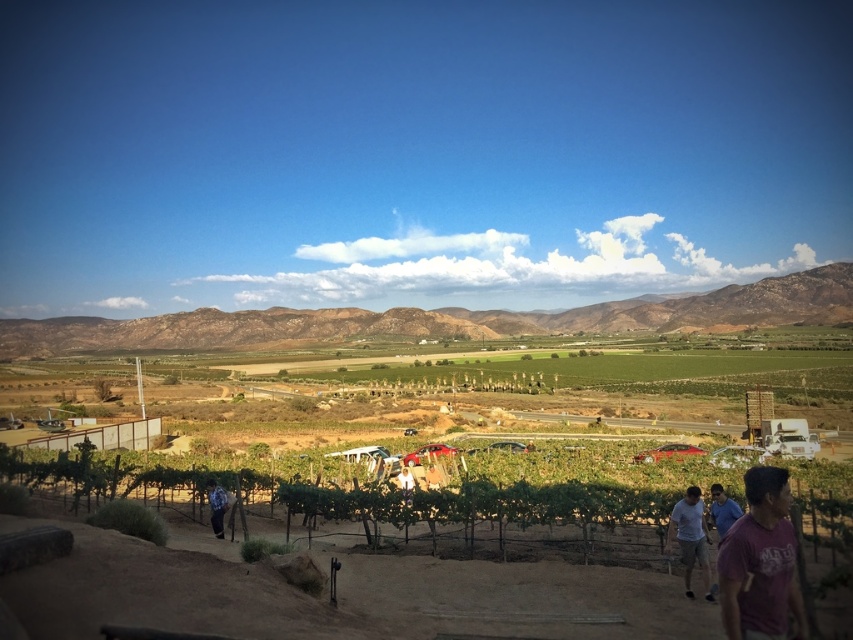
You are a photographer positioned at the edge of the vineyard and want to capture both the light blue shirt at lower right and the white fabric at center in your photo. Which object will appear larger in the photo?

The light blue shirt at lower right will appear larger in the photo because it is closer to the viewer than the white fabric at center.

You are a photographer standing at the edge of the vineyard. You want to capture a photo that includes both the green grassy hill at center and the white cotton shirt at lower right. Which object should you focus on first if you want both to be in clear focus?

The green grassy hill at center is taller than the white cotton shirt at lower right. To ensure both are in clear focus, you should focus on the green grassy hill at center first since it is farther away and taller, allowing the white cotton shirt at lower right to fall within the depth of field.

Looking at this image, you are a photographer planning to capture a photo of the light blue shirt at lower right and the white fabric at center. Which object should you focus on first if you want to include both in your frame without moving the camera?

The light blue shirt at lower right is much taller than the white fabric at center, so you should focus on the light blue shirt at lower right first to ensure it is in frame and properly exposed before adjusting for the white fabric at center.